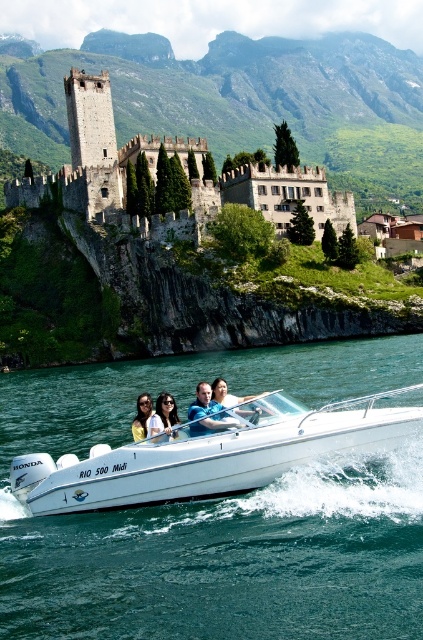
Does clear blue water at boat front lie behind stone medieval castle at center?

That is False.

Which is above, clear blue water at boat front or stone medieval castle at center?

stone medieval castle at center is higher up.

Locate an element on the screen. Image resolution: width=423 pixels, height=640 pixels. clear blue water at boat front is located at coordinates (217, 513).

Can you confirm if smooth tan skin at center is shorter than matte black hair at center?

In fact, smooth tan skin at center may be taller than matte black hair at center.

Which is behind, point (225, 428) or point (156, 413)?

Point (156, 413)

Is point (200, 397) farther from viewer compared to point (167, 396)?

That is True.

Where is `smooth tan skin at center`? smooth tan skin at center is located at coordinates 208,413.

Who is positioned more to the right, clear blue water at boat front or white glossy boat at lower center?

From the viewer's perspective, white glossy boat at lower center appears more on the right side.

Which of these two, clear blue water at boat front or white glossy boat at lower center, stands taller?

Standing taller between the two is clear blue water at boat front.

Which is in front, point (189, 529) or point (296, 444)?

Positioned in front is point (296, 444).

Locate an element on the screen. This screenshot has width=423, height=640. clear blue water at boat front is located at coordinates (217, 513).